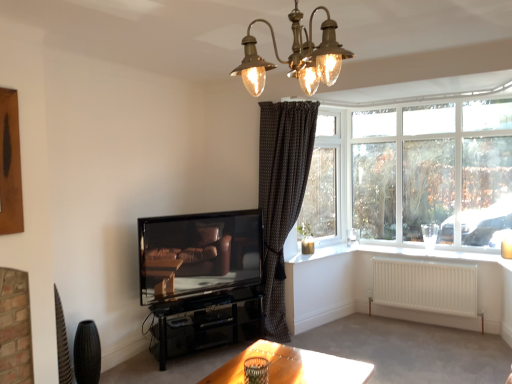
Question: Should I look upward or downward to see white glass window at upper right?

Choices:
 (A) down
 (B) up

Answer: (B)

Question: Is white glass window at upper right in front of matte black television at center?

Choices:
 (A) no
 (B) yes

Answer: (A)

Question: Does white glass window at upper right turn towards matte black television at center?

Choices:
 (A) no
 (B) yes

Answer: (B)

Question: Would you say matte black television at center is part of white glass window at upper right's contents?

Choices:
 (A) yes
 (B) no

Answer: (B)

Question: Is white glass window at upper right bigger than matte black television at center?

Choices:
 (A) yes
 (B) no

Answer: (B)

Question: Does white glass window at upper right have a greater height compared to matte black television at center?

Choices:
 (A) yes
 (B) no

Answer: (A)

Question: Is white glass window at upper right at the right side of matte black television at center?

Choices:
 (A) yes
 (B) no

Answer: (A)

Question: Does matte black television at center have a lesser height compared to brass textured chandelier at upper center?

Choices:
 (A) yes
 (B) no

Answer: (B)

Question: From the image's perspective, is matte black television at center on brass textured chandelier at upper center?

Choices:
 (A) no
 (B) yes

Answer: (A)

Question: Is brass textured chandelier at upper center a part of matte black television at center?

Choices:
 (A) yes
 (B) no

Answer: (B)

Question: From a real-world perspective, is matte black television at center located higher than brass textured chandelier at upper center?

Choices:
 (A) yes
 (B) no

Answer: (B)

Question: From the image's perspective, does matte black television at center appear lower than brass textured chandelier at upper center?

Choices:
 (A) yes
 (B) no

Answer: (A)

Question: From a real-world perspective, is matte black television at center located beneath brass textured chandelier at upper center?

Choices:
 (A) no
 (B) yes

Answer: (B)

Question: From the image's perspective, is brass textured chandelier at upper center located above matte black television at center?

Choices:
 (A) no
 (B) yes

Answer: (B)